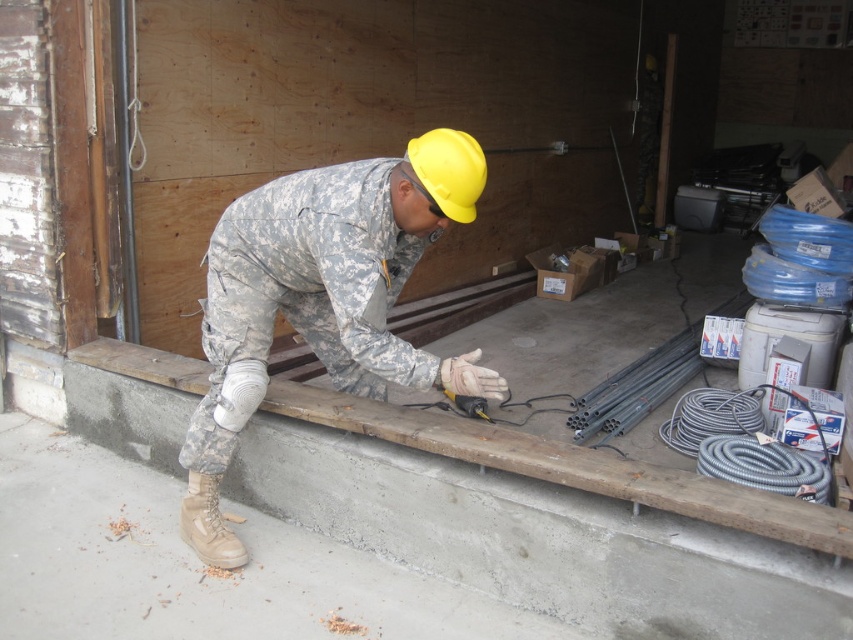
You are a construction worker carrying a 24 inch tool box. You need to walk from the gray concrete at lower left to the wooden plank at center. Can you safely carry the box without dropping it?

The gray concrete at lower left and wooden plank at center are 25.22 inches apart from each other. Since the tool box is 24 inches long, it can be safely carried between them without dropping.

You are a construction worker standing on the gray concrete at lower left and need to reach the wooden plank at center to continue your work. Which direction should you move to get there?

You should move to the right because the gray concrete at lower left is to the left of the wooden plank at center, so moving right will take you towards it.